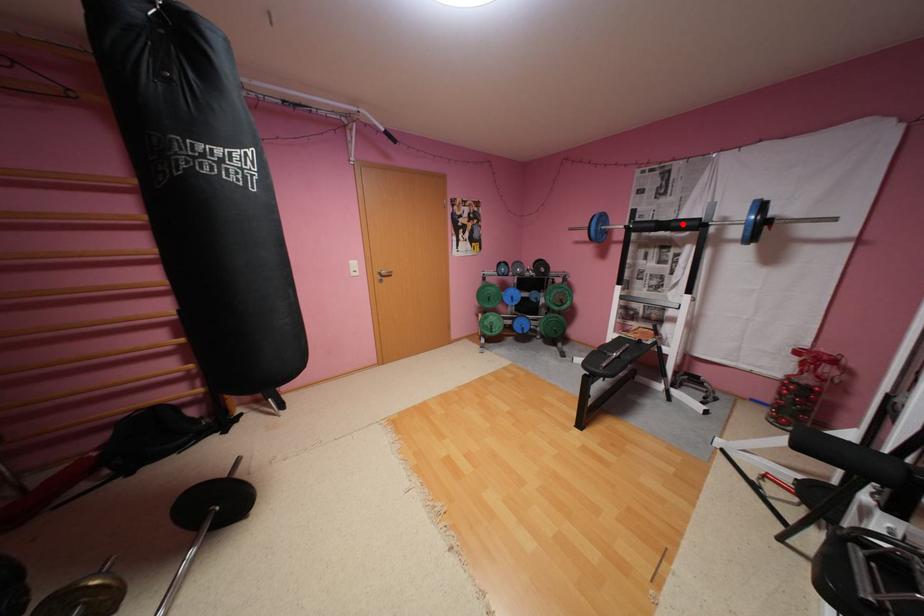
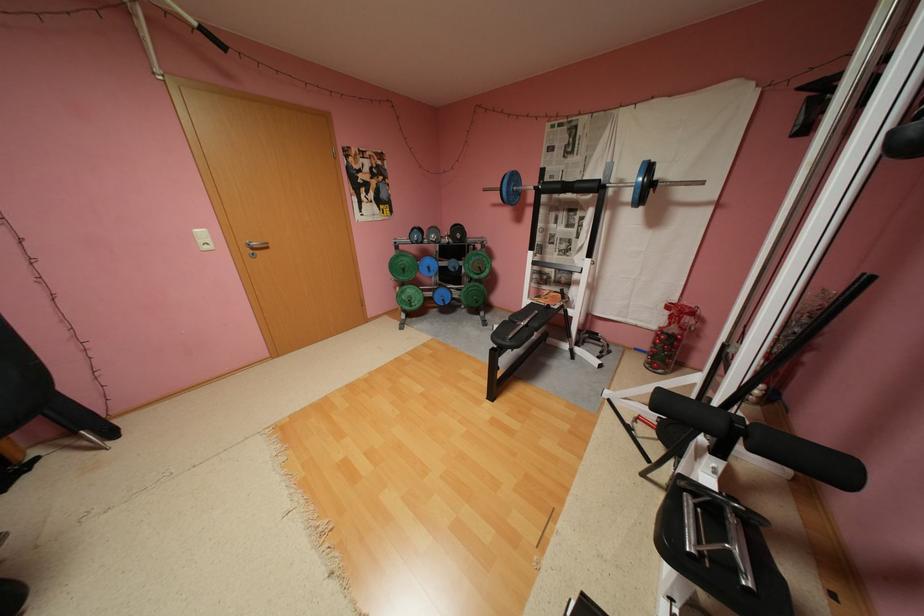
Question: I am providing you with two images of the same scene from different viewpoints. A red point is marked on the first image. Is the red point's position out of view in image 2?

Choices:
 (A) Yes
 (B) No

Answer: (B)